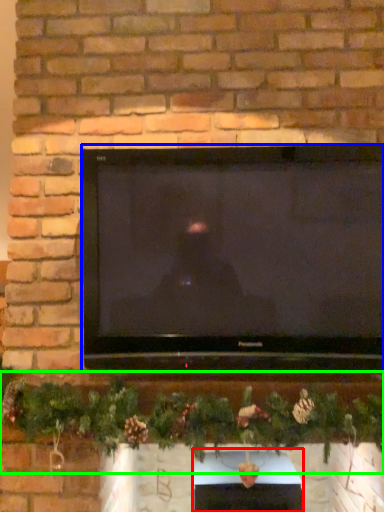
Question: Estimate the real-world distances between objects in this image. Which object is farther from fireplace (highlighted by a red box), television (highlighted by a blue box) or christmas decoration (highlighted by a green box)?

Choices:
 (A) television
 (B) christmas decoration

Answer: (A)